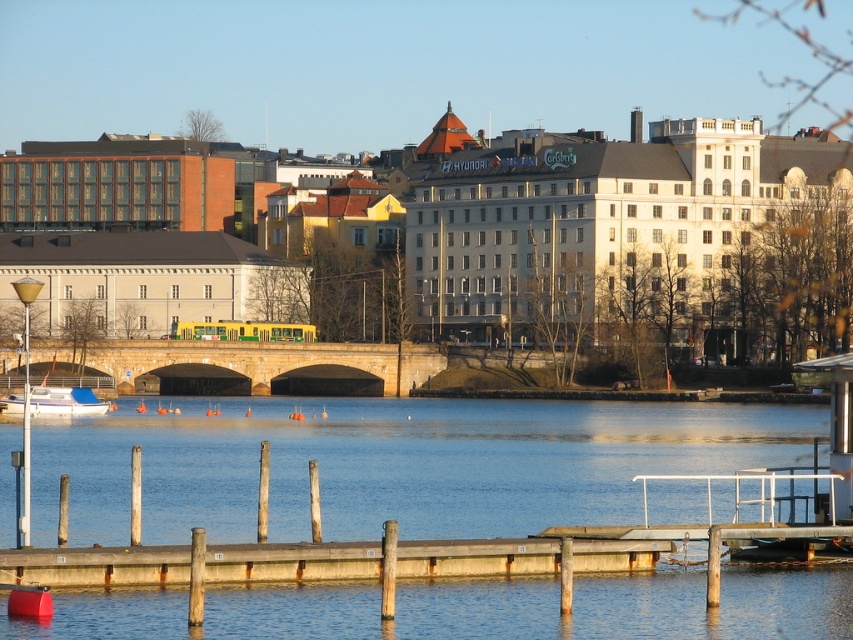
Which is in front, point (616, 419) or point (49, 413)?

Point (49, 413) is in front.

Which is behind, point (45, 504) or point (97, 403)?

The point (97, 403) is behind.

Find the location of `blue water at lower center`. blue water at lower center is located at coordinates (393, 464).

At what (x,y) coordinates should I click in order to perform the action: click on blue water at lower center. Please return your answer as a coordinate pair (x, y). The image size is (853, 640). Looking at the image, I should click on (393, 464).

Does wooden dock at lower center appear on the right side of white matte boat at lower left?

Indeed, wooden dock at lower center is positioned on the right side of white matte boat at lower left.

Can you confirm if wooden dock at lower center is smaller than white matte boat at lower left?

Correct, wooden dock at lower center occupies less space than white matte boat at lower left.

Does point (77, 570) come closer to viewer compared to point (96, 406)?

Yes, point (77, 570) is closer to viewer.

I want to click on wooden dock at lower center, so click(96, 564).

The height and width of the screenshot is (640, 853). Find the location of `blue water at lower center`. blue water at lower center is located at coordinates (393, 464).

Consider the image. Does blue water at lower center have a greater width compared to wooden dock at lower center?

Indeed, blue water at lower center has a greater width compared to wooden dock at lower center.

You are a GUI agent. You are given a task and a screenshot of the screen. Output one action in this format:
    pyautogui.click(x=<x>, y=<y>)
    Task: Click on the blue water at lower center
    The image size is (853, 640).
    Given the screenshot: What is the action you would take?
    pyautogui.click(x=393, y=464)